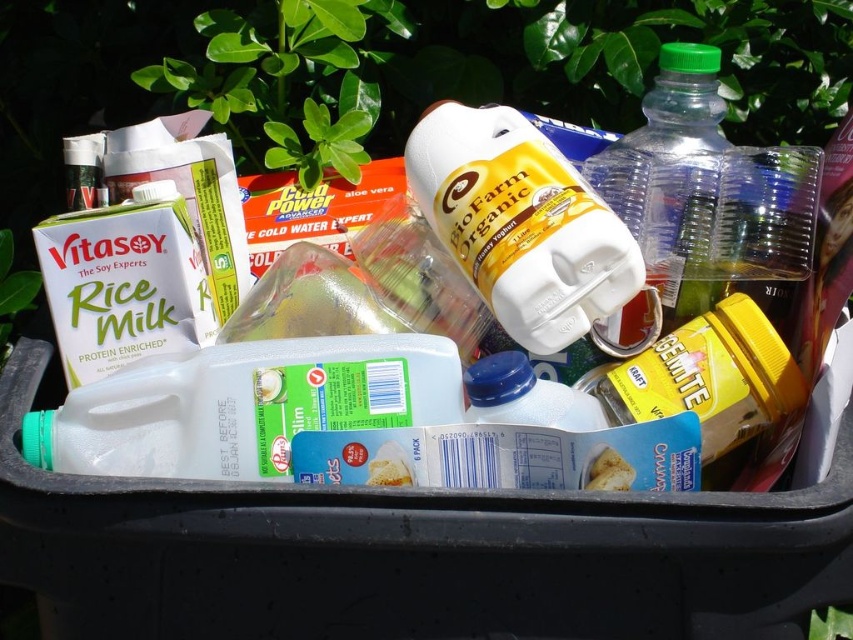
Question: Is metallic silver can at upper left thinner than white matte bread at center?

Choices:
 (A) no
 (B) yes

Answer: (A)

Question: Which of the following is the farthest from the observer?

Choices:
 (A) green translucent bottle at center-right
 (B) white plastic jug at center

Answer: (A)

Question: Among these objects, which one is farthest from the camera?

Choices:
 (A) green translucent bottle at center-right
 (B) white plastic jug at center

Answer: (A)

Question: Is yellow matte jar at center-right below white matte bread at center?

Choices:
 (A) no
 (B) yes

Answer: (A)

Question: Is green translucent bottle at center-right smaller than yellow matte jar at center-right?

Choices:
 (A) yes
 (B) no

Answer: (B)

Question: Which point is closer to the camera?

Choices:
 (A) (102, 154)
 (B) (720, 310)

Answer: (B)